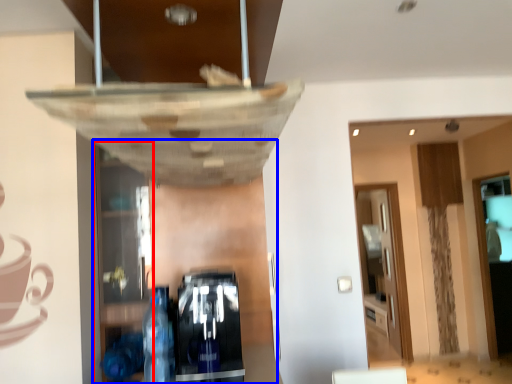
Question: Among these objects, which one is farthest to the camera, shelf (highlighted by a red box) or shelf (highlighted by a blue box)?

Choices:
 (A) shelf
 (B) shelf

Answer: (B)